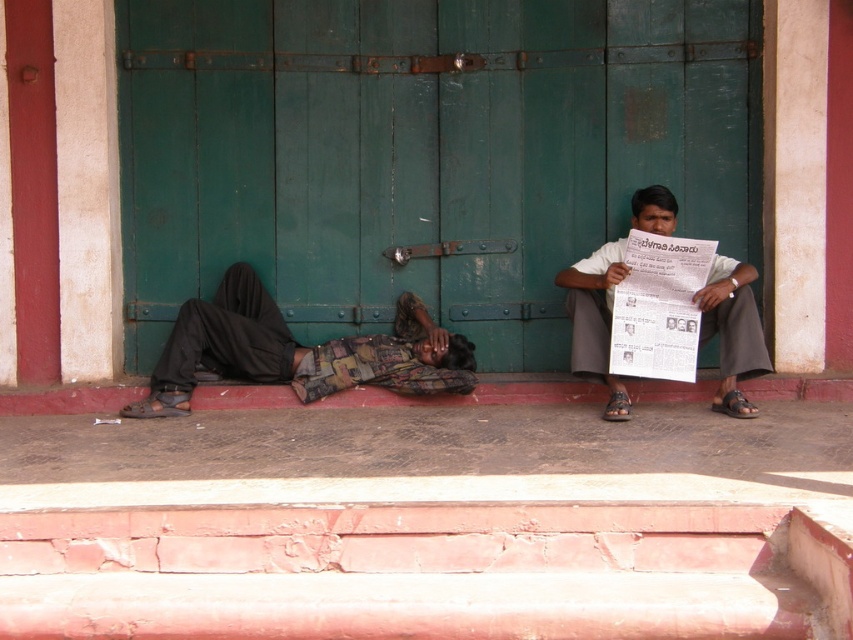
Can you confirm if camouflage-patterned fabric at lower left is taller than white paper at right?

In fact, camouflage-patterned fabric at lower left may be shorter than white paper at right.

Who is lower down, camouflage-patterned fabric at lower left or white paper at right?

camouflage-patterned fabric at lower left is below.

Identify the location of camouflage-patterned fabric at lower left. (299, 352).

Consider the image. Between green wooden door at center and camouflage-patterned fabric at lower left, which one appears on the right side from the viewer's perspective?

Positioned to the right is green wooden door at center.

Does point (393, 54) lie in front of point (228, 340)?

That is False.

The height and width of the screenshot is (640, 853). Find the location of `green wooden door at center`. green wooden door at center is located at coordinates (419, 152).

Which is above, green wooden door at center or white paper at right?

green wooden door at center is above.

Which is behind, point (277, 120) or point (645, 221)?

Point (277, 120)

At what (x,y) coordinates should I click in order to perform the action: click on green wooden door at center. Please return your answer as a coordinate pair (x, y). Image resolution: width=853 pixels, height=640 pixels. Looking at the image, I should click on (419, 152).